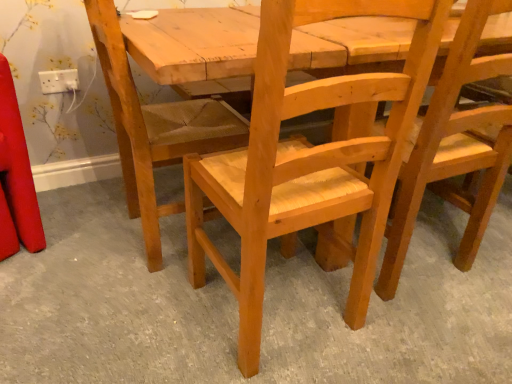
Question: From the image's perspective, is natural wood chair at center over natural wood chair at center, the second chair when ordered from left to right?

Choices:
 (A) yes
 (B) no

Answer: (B)

Question: Is natural wood chair at center wider than natural wood chair at center, which is the second chair in right-to-left order?

Choices:
 (A) no
 (B) yes

Answer: (B)

Question: Can you confirm if natural wood chair at center is shorter than natural wood chair at center, the second chair when ordered from left to right?

Choices:
 (A) no
 (B) yes

Answer: (B)

Question: From the image's perspective, would you say natural wood chair at center is shown under natural wood chair at center, the second chair when ordered from left to right?

Choices:
 (A) no
 (B) yes

Answer: (B)

Question: Could you tell me if natural wood chair at center is facing natural wood chair at center, the second chair when ordered from left to right?

Choices:
 (A) no
 (B) yes

Answer: (A)

Question: Based on their sizes in the image, would you say natural wood chair at center, which is the second chair in right-to-left order, is bigger or smaller than natural wood chair at center, the third chair positioned from the right?

Choices:
 (A) big
 (B) small

Answer: (A)

Question: From the image's perspective, is natural wood chair at center, which is the second chair in right-to-left order, positioned above or below natural wood chair at center, marked as the 1th chair in a left-to-right arrangement?

Choices:
 (A) below
 (B) above

Answer: (A)

Question: Is point (215, 183) positioned closer to the camera than point (232, 36)?

Choices:
 (A) farther
 (B) closer

Answer: (B)

Question: In terms of width, does natural wood chair at center, the second chair when ordered from left to right, look wider or thinner when compared to natural wood chair at center, the third chair positioned from the right?

Choices:
 (A) thin
 (B) wide

Answer: (A)

Question: Considering the positions of white plastic socket at upper left and natural wood chair at center, the second chair when ordered from left to right, in the image, is white plastic socket at upper left wider or thinner than natural wood chair at center, the second chair when ordered from left to right,?

Choices:
 (A) wide
 (B) thin

Answer: (B)

Question: From a real-world perspective, is white plastic socket at upper left above or below natural wood chair at center, which is the second chair in right-to-left order?

Choices:
 (A) above
 (B) below

Answer: (A)

Question: Is white plastic socket at upper left spatially inside natural wood chair at center, which is the second chair in right-to-left order, or outside of it?

Choices:
 (A) inside
 (B) outside

Answer: (B)

Question: Is white plastic socket at upper left taller or shorter than natural wood chair at center, the second chair when ordered from left to right?

Choices:
 (A) tall
 (B) short

Answer: (B)

Question: Do you think white plastic socket at upper left is within natural wood chair at center, or outside of it?

Choices:
 (A) inside
 (B) outside

Answer: (B)

Question: In the image, is white plastic socket at upper left positioned in front of or behind natural wood chair at center?

Choices:
 (A) front
 (B) behind

Answer: (B)